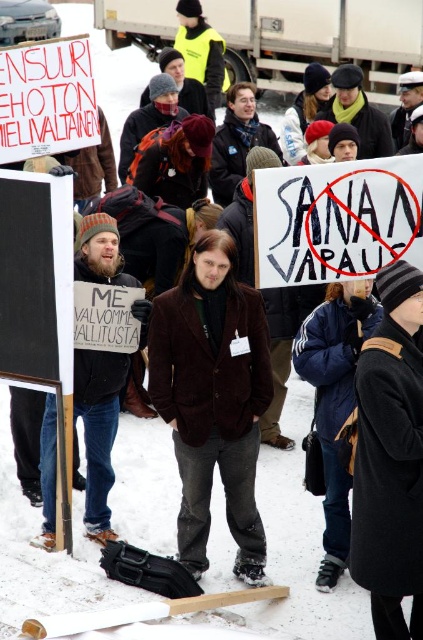
Question: Can you confirm if bearded man with sign at center is bigger than red cardboard sign at upper left?

Choices:
 (A) yes
 (B) no

Answer: (A)

Question: Among these objects, which one is farthest from the camera?

Choices:
 (A) black paper sign at center
 (B) velvet brown blazer at center
 (C) bearded man with sign at center

Answer: (C)

Question: Which of the following is the closest to the observer?

Choices:
 (A) velvet brown blazer at center
 (B) red cardboard sign at upper left
 (C) black woolen hat at upper right

Answer: (C)

Question: Can you confirm if black woolen hat at upper right is thinner than bearded man with sign at center?

Choices:
 (A) no
 (B) yes

Answer: (B)

Question: Is velvet brown blazer at center positioned at the back of black woolen hat at upper right?

Choices:
 (A) yes
 (B) no

Answer: (A)

Question: Which point is farther to the camera?

Choices:
 (A) red cardboard sign at upper left
 (B) velvet brown blazer at center

Answer: (A)